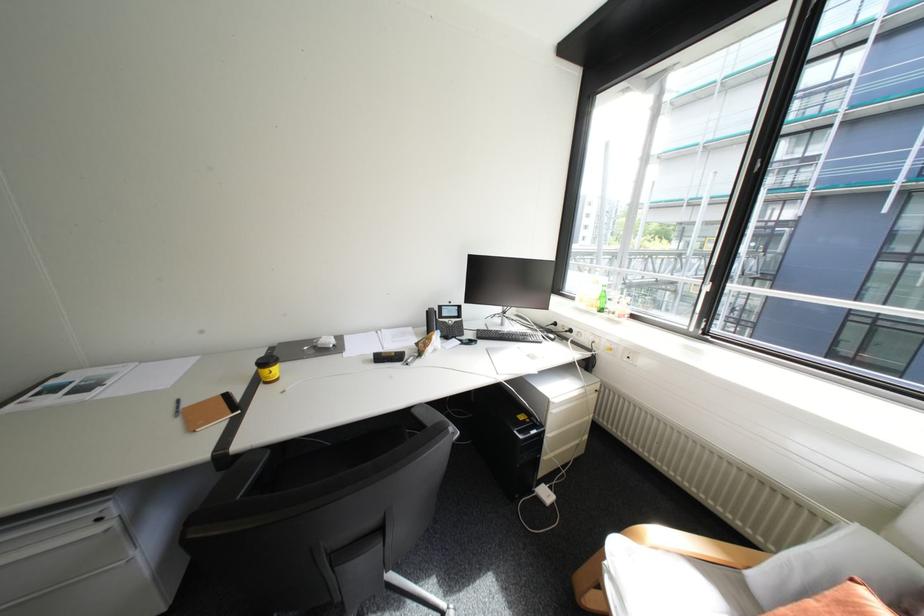
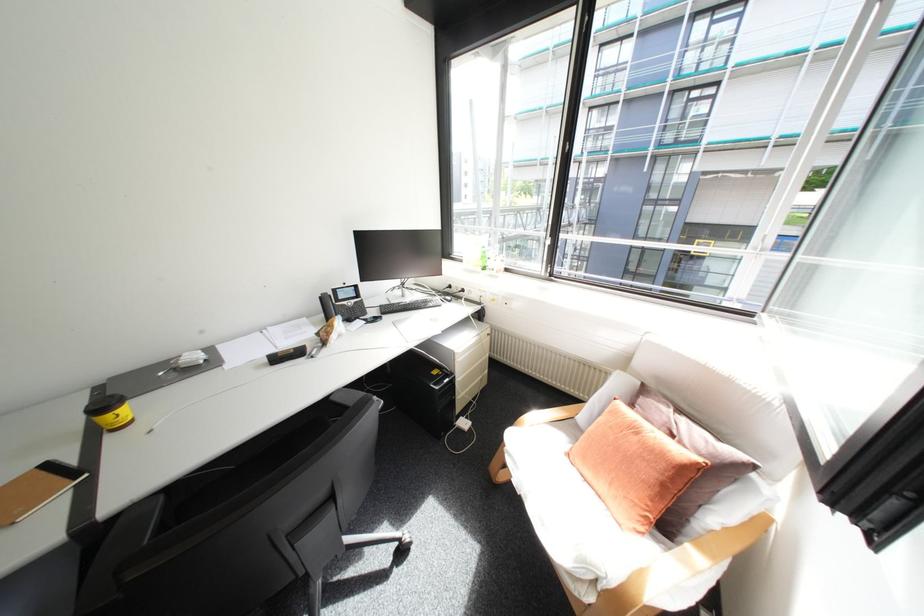
Question: Which direction would the cameraman need to move to produce the second image? Reply with the corresponding letter.

Choices:
 (A) Left
 (B) Right
 (C) Forward
 (D) Backward

Answer: (D)